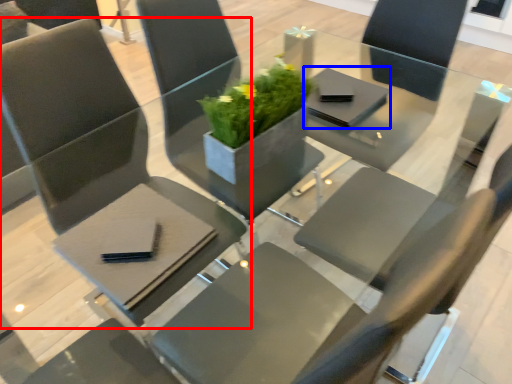
Question: Which object appears farthest to the camera in this image, chair (highlighted by a red box) or pad (highlighted by a blue box)?

Choices:
 (A) chair
 (B) pad

Answer: (B)